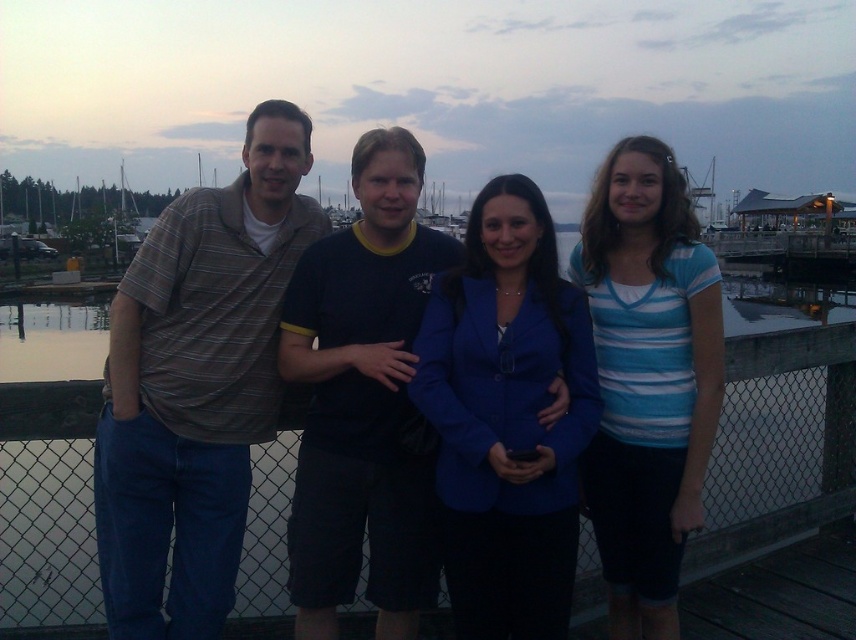
Question: Does blue fabric jacket at center have a lesser width compared to matte striped shirt at left?

Choices:
 (A) yes
 (B) no

Answer: (A)

Question: Which point appears closest to the camera in this image?

Choices:
 (A) (672, 177)
 (B) (672, 156)

Answer: (A)

Question: Is striped cotton shirt at left wider than dark blue t-shirt at center?

Choices:
 (A) no
 (B) yes

Answer: (B)

Question: Among these points, which one is farthest from the camera?

Choices:
 (A) (321, 621)
 (B) (694, 285)
 (C) (221, 248)

Answer: (C)

Question: Is dark blue t-shirt at center thinner than blue striped shirt at center?

Choices:
 (A) yes
 (B) no

Answer: (B)

Question: Which point appears farthest from the camera in this image?

Choices:
 (A) (360, 456)
 (B) (447, 458)
 (C) (256, 125)

Answer: (C)